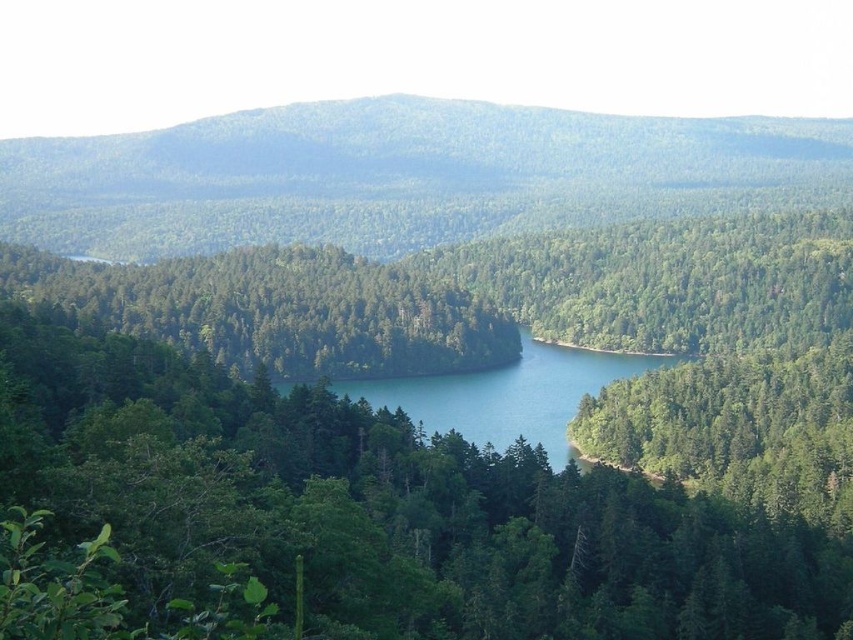
Can you confirm if green matte tree at center is wider than green forested mountain at upper center?

Incorrect, green matte tree at center's width does not surpass green forested mountain at upper center's.

From the picture: Which is above, green matte tree at center or green forested mountain at upper center?

green forested mountain at upper center is above.

This screenshot has width=853, height=640. Find the location of `green matte tree at center`. green matte tree at center is located at coordinates (456, 435).